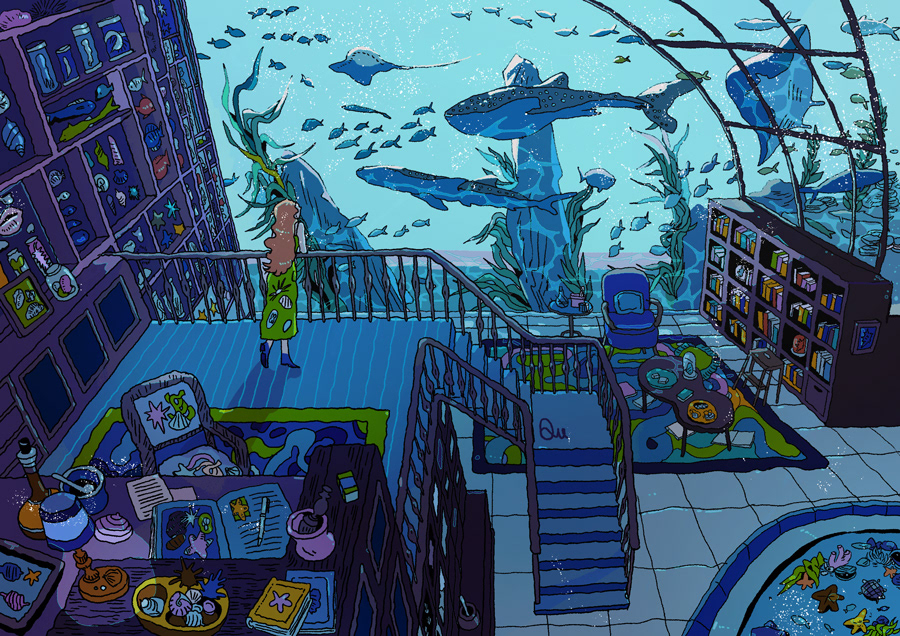
You are a GUI agent. You are given a task and a screenshot of the screen. Output one action in this format:
    pyautogui.click(x=<x>, y=<y>)
    Task: Click on the right side bookcase
    The image size is (900, 636).
    Given the screenshot: What is the action you would take?
    pyautogui.click(x=855, y=356)